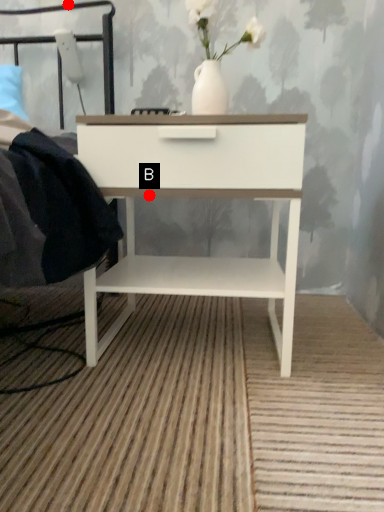
Question: Two points are circled on the image, labeled by A and B beside each circle. Which point is closer to the camera taking this photo?

Choices:
 (A) A is closer
 (B) B is closer

Answer: (B)